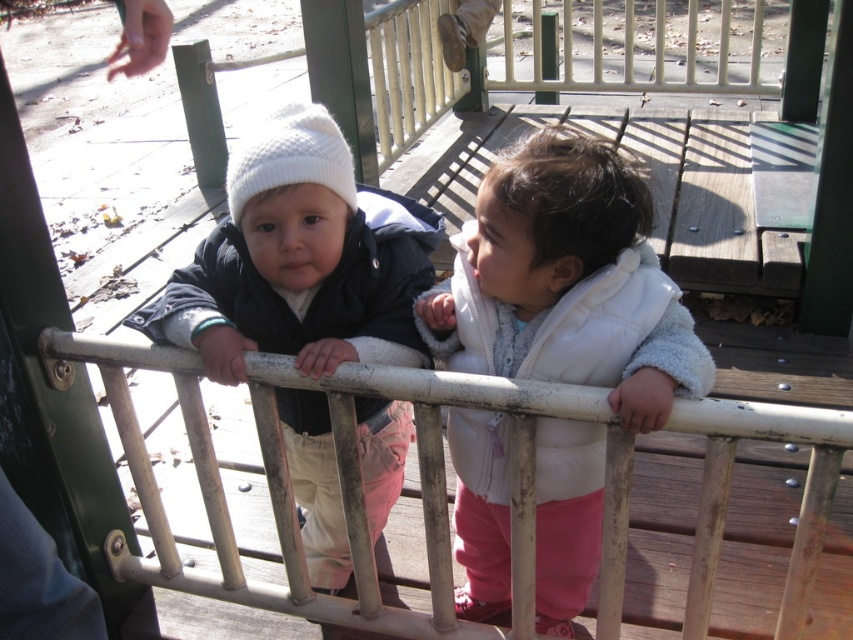
Who is more distant from viewer, (781, 618) or (283, 157)?

Point (283, 157)

Can you confirm if white metal rail at center is thinner than white knitted hat at upper center?

No.

Does point (714, 547) lie behind point (315, 132)?

That is False.

This screenshot has height=640, width=853. Find the location of `white metal rail at center`. white metal rail at center is located at coordinates (334, 477).

Is white metal rail at center below matte white beanie at center?

Yes.

Is white metal rail at center bigger than matte white beanie at center?

Yes.

What do you see at coordinates (334, 477) in the screenshot?
I see `white metal rail at center` at bounding box center [334, 477].

Image resolution: width=853 pixels, height=640 pixels. I want to click on white metal rail at center, so click(334, 477).

Is point (309, 308) positioned before point (329, 134)?

No, it is not.

Is point (374, 273) positioned after point (351, 166)?

Yes, it is behind point (351, 166).

Between point (167, 310) and point (248, 154), which one is positioned behind?

The point (167, 310) is more distant.

The image size is (853, 640). In order to click on matte white beanie at center in this screenshot , I will do pos(300,260).